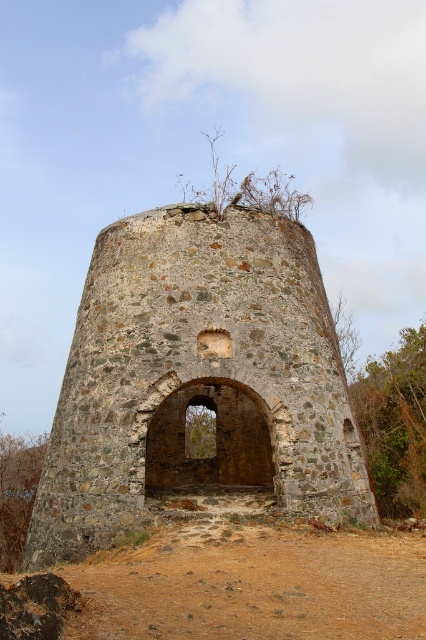
Measure the distance between rustic stone tower at center and camera.

The distance of rustic stone tower at center from camera is 86.92 feet.

Measure the distance between point (x=258, y=241) and camera.

Point (x=258, y=241) and camera are 33.85 meters apart from each other.

The width and height of the screenshot is (426, 640). I want to click on rustic stone tower at center, so 198,380.